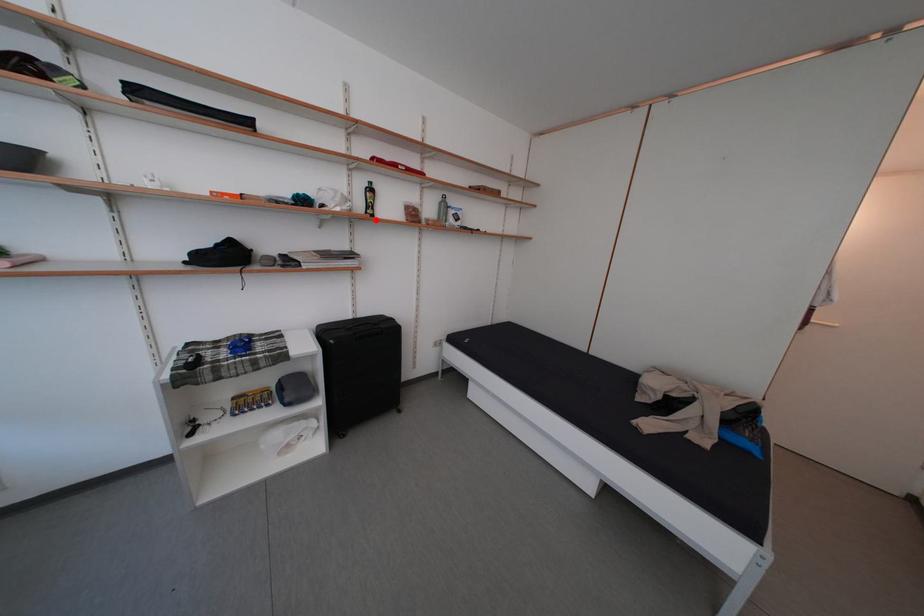
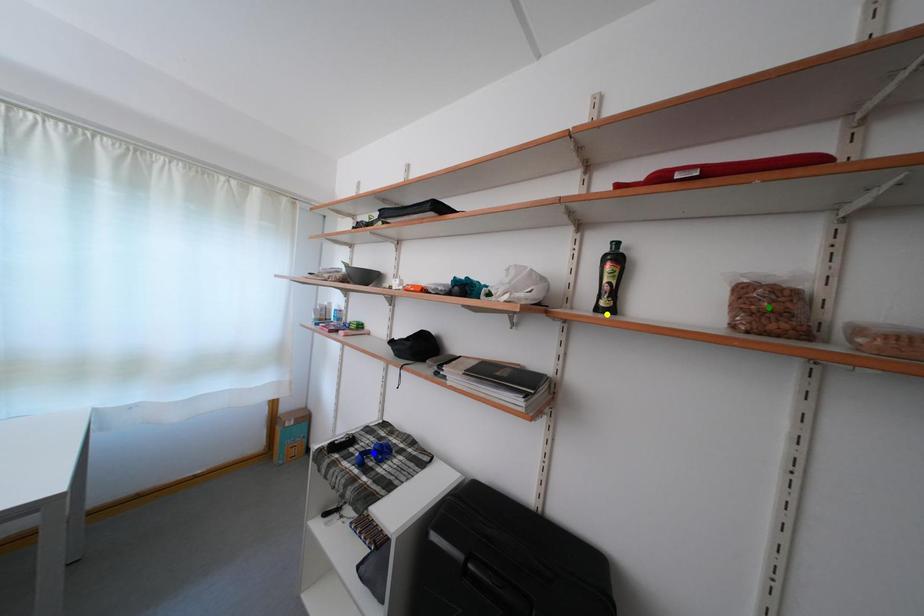
Question: I am providing you with two images of the same scene from different viewpoints. A red point is marked on the first image. You are given multiple points on the second image. Which point in image 2 is actually the same real-world point as the red point in image 1?

Choices:
 (A) green point
 (B) yellow point
 (C) blue point

Answer: (B)